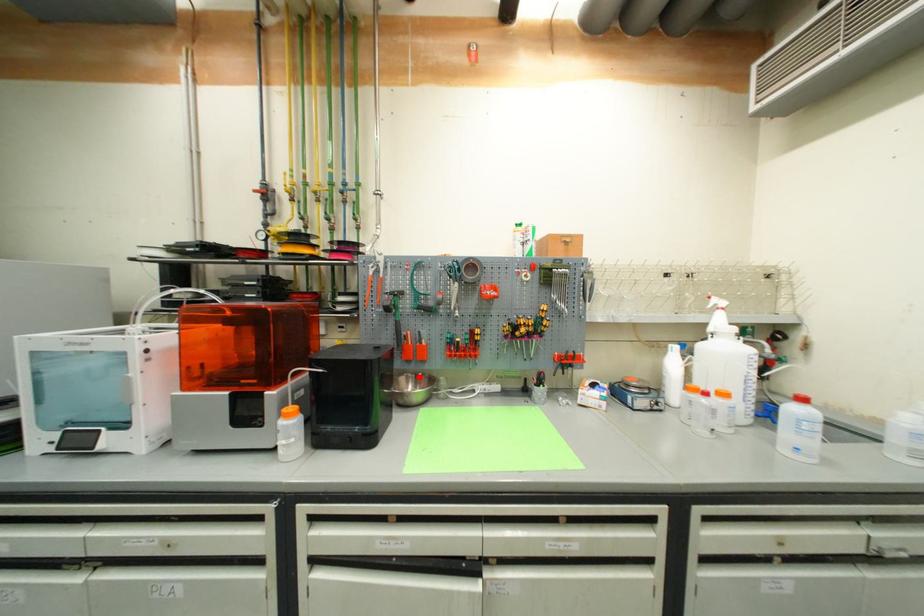
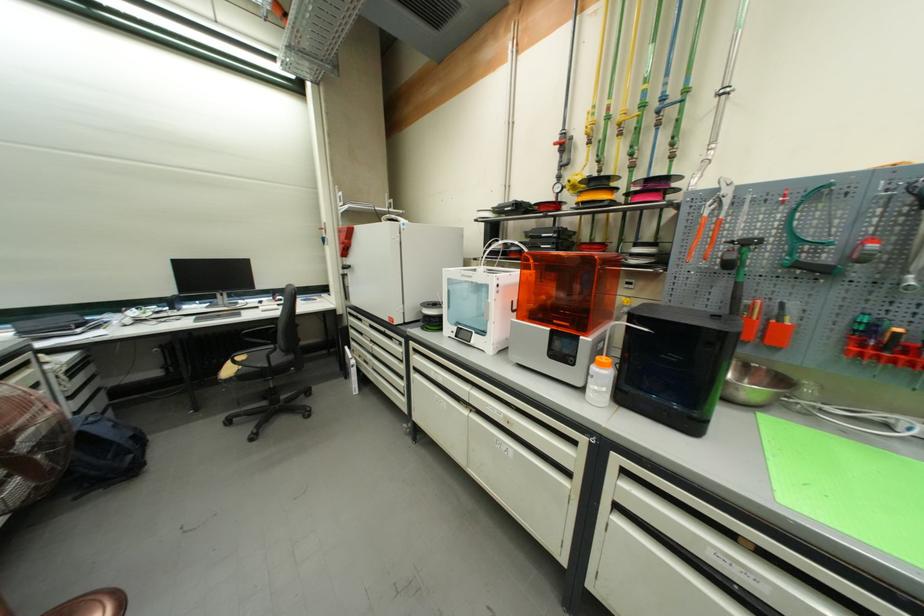
In the second image, find the point that corresponds to the highlighted location in the first image.

(745, 363)